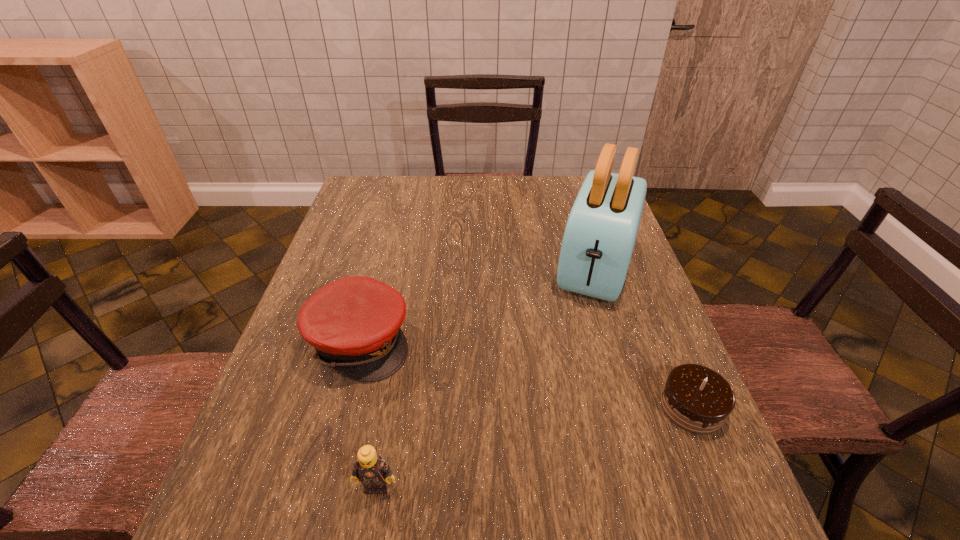
Image resolution: width=960 pixels, height=540 pixels. In order to click on vacant space located on the front of the cap with an emblem in this screenshot , I will do `click(576, 430)`.

Locate an element on the screen. Image resolution: width=960 pixels, height=540 pixels. object present at the near edge is located at coordinates (370, 469).

Find the location of a particular element. Image resolution: width=960 pixels, height=540 pixels. object that is at the left edge is located at coordinates (354, 323).

At what (x,y) coordinates should I click in order to perform the action: click on chocolate cake located at the right edge. Please return your answer as a coordinate pair (x, y). The width and height of the screenshot is (960, 540). Looking at the image, I should click on (697, 399).

Locate an element on the screen. This screenshot has width=960, height=540. toaster situated at the right edge is located at coordinates coord(600,234).

In the image, there is a desktop. At what (x,y) coordinates should I click in order to perform the action: click on vacant space at the far edge. Please return your answer as a coordinate pair (x, y). The width and height of the screenshot is (960, 540). Looking at the image, I should click on (397, 205).

Find the location of a particular element. free space at the near edge is located at coordinates (403, 459).

The image size is (960, 540). Find the location of `vacant area at the left edge`. vacant area at the left edge is located at coordinates tap(369, 229).

I want to click on vacant space at the right edge, so click(616, 342).

In the image, there is a desktop. Where is `vacant space at the far left corner`? This screenshot has height=540, width=960. vacant space at the far left corner is located at coordinates (355, 199).